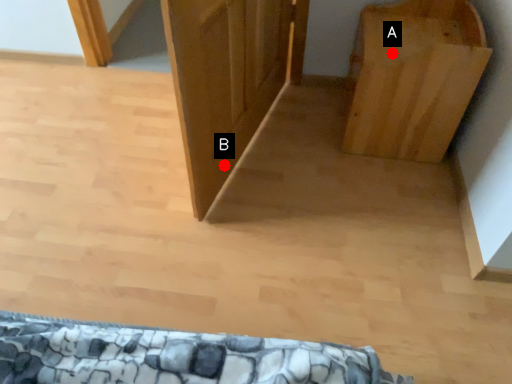
Question: Two points are circled on the image, labeled by A and B beside each circle. Which point is farther to the camera?

Choices:
 (A) A is further
 (B) B is further

Answer: (B)